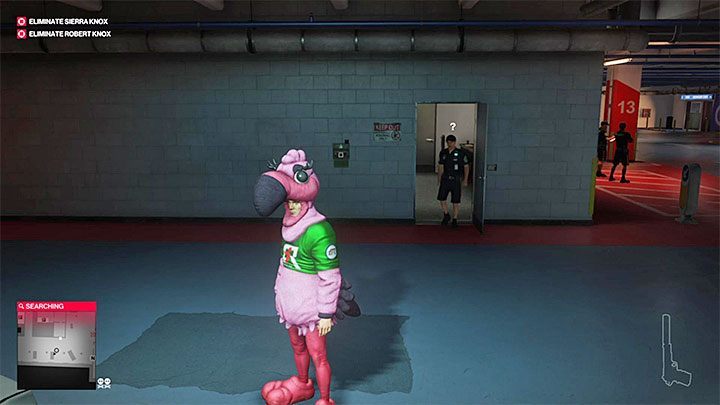
Where is `grey floor`? The width and height of the screenshot is (720, 405). grey floor is located at coordinates click(x=466, y=338).